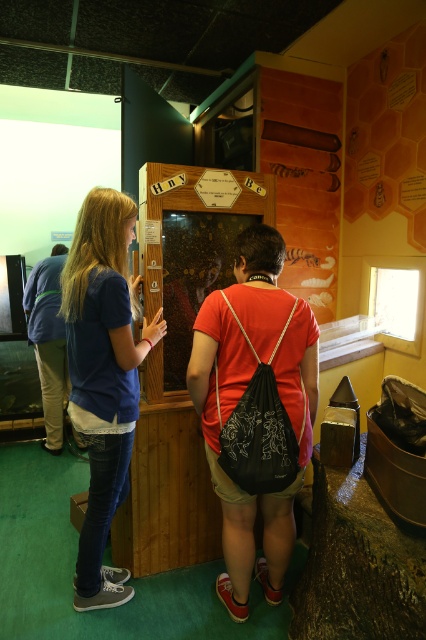
You are a visitor at the exhibit and want to take a photo of the wooden honeycomb display at center without the blue denim jeans at left blocking the view. Is the display visible above the jeans?

The blue denim jeans at left is taller than wooden honeycomb display at center, so the jeans would block the view of the display. Move to a position where you can see above the jeans to capture the display without obstruction.

You are standing in an educational exhibit about bees. You see a person wearing blue denim jeans at left and a wooden honeycomb display at center. Which object is positioned to the left of the other?

The blue denim jeans at left is to the left of wooden honeycomb display at center.